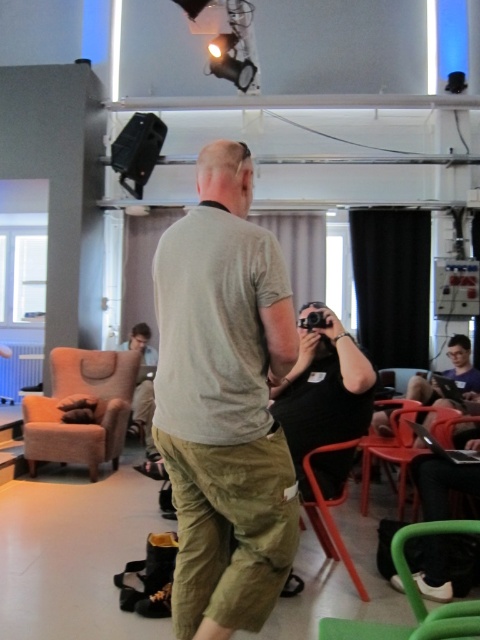
Question: Among these objects, which one is nearest to the camera?

Choices:
 (A) khaki pants at center
 (B) green plastic chair at lower right
 (C) black matte camera at center

Answer: (B)

Question: Where is green plastic chair at lower right located in relation to black plastic video camera at center in the image?

Choices:
 (A) left
 (B) right

Answer: (B)

Question: Based on their relative distances, which object is nearer to the black matte camera at center?

Choices:
 (A) khaki pants at center
 (B) matte black camera at lower center

Answer: (A)

Question: In this image, where is khaki pants at center located relative to green plastic chair at lower right?

Choices:
 (A) below
 (B) above

Answer: (B)

Question: Can you confirm if orange plastic chair at lower center is bigger than black plastic video camera at center?

Choices:
 (A) no
 (B) yes

Answer: (B)

Question: Which object appears farthest from the camera in this image?

Choices:
 (A) orange plastic chair at lower center
 (B) green plastic chair at lower right
 (C) black plastic video camera at center

Answer: (A)